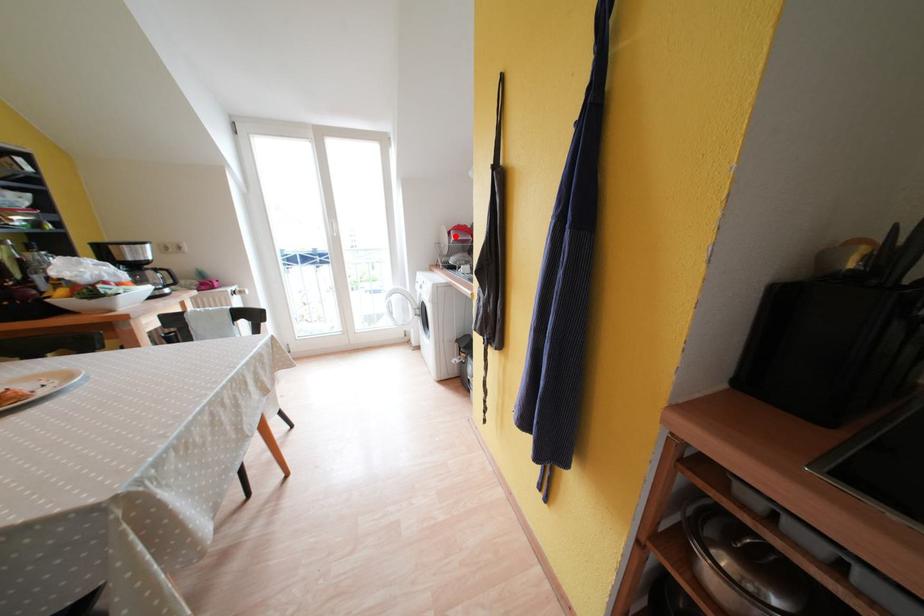
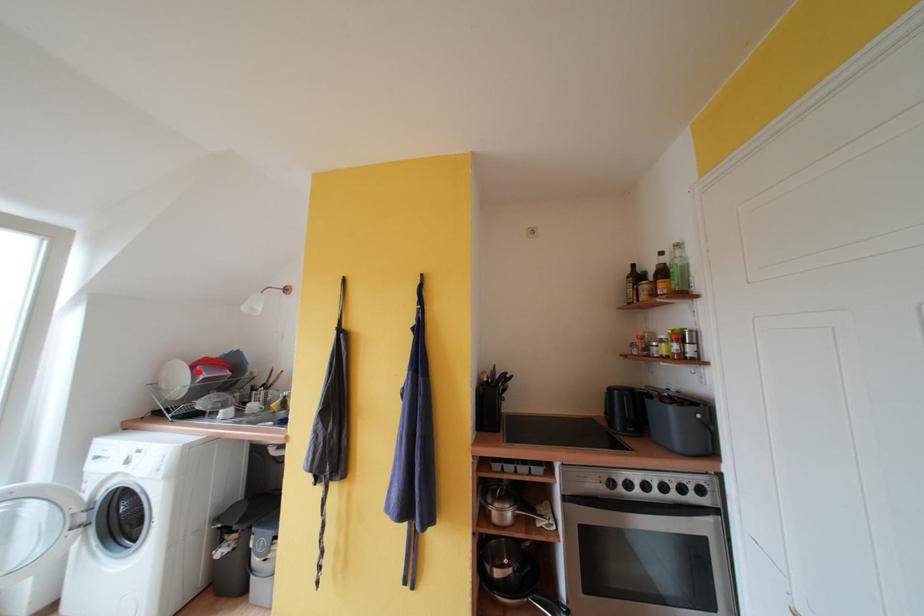
I am providing you with two images of the same scene from different viewpoints. A red point is marked on the first image and another point is marked on the second image. Are the points marked in image1 and image2 representing the same 3D position?

Yes